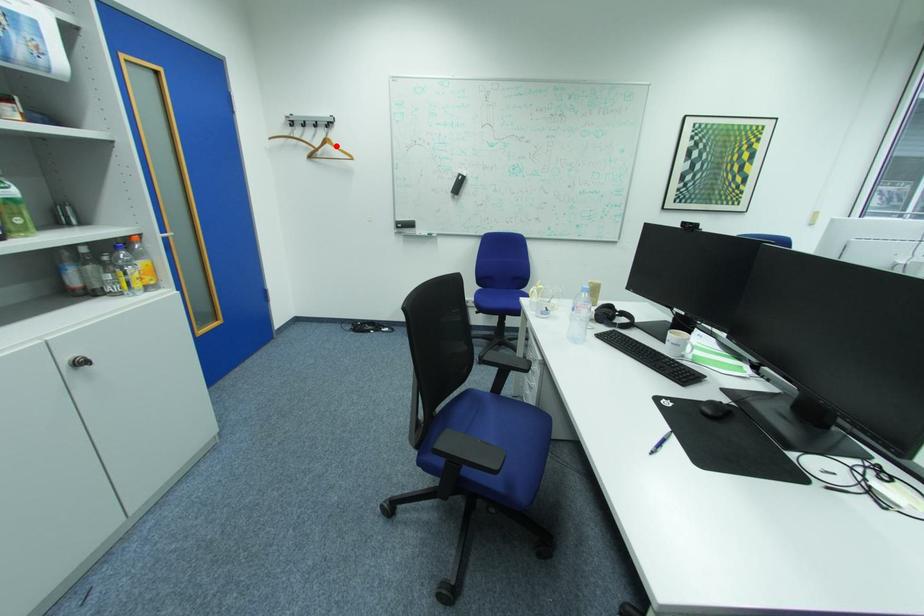
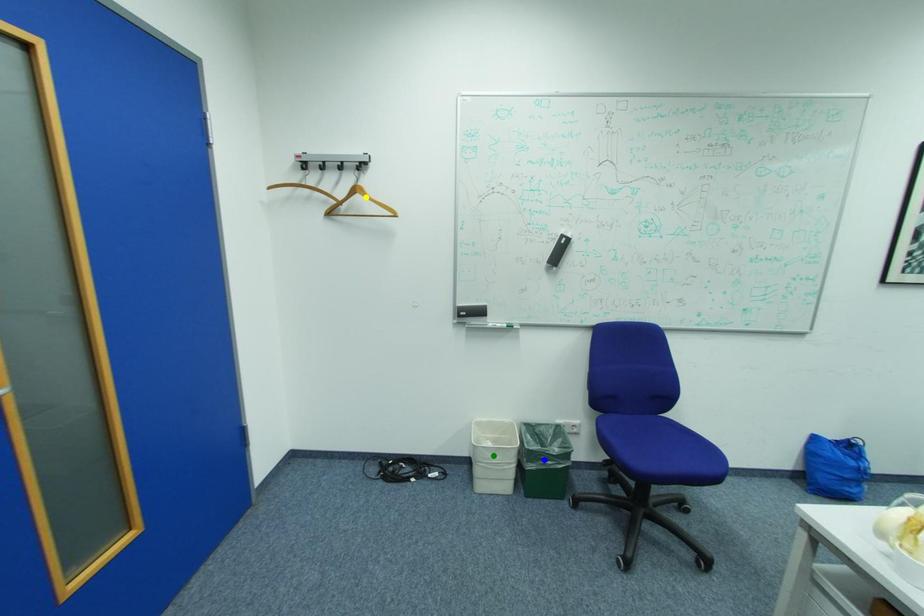
Question: I am providing you with two images of the same scene from different viewpoints. A red point is marked on the first image. You are given multiple points on the second image. Which spot in image 2 lines up with the point in image 1?

Choices:
 (A) blue point
 (B) yellow point
 (C) green point

Answer: (B)